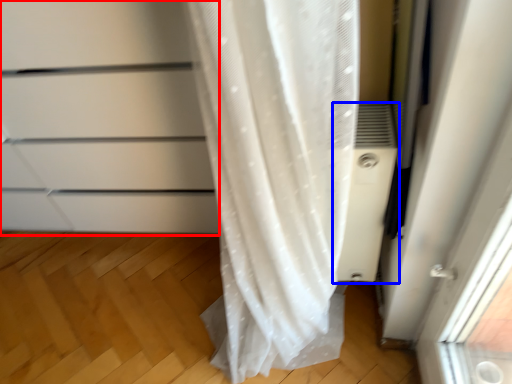
Question: Which of the following is the closest to the observer, cabinetry (highlighted by a red box) or air conditioner (highlighted by a blue box)?

Choices:
 (A) cabinetry
 (B) air conditioner

Answer: (A)